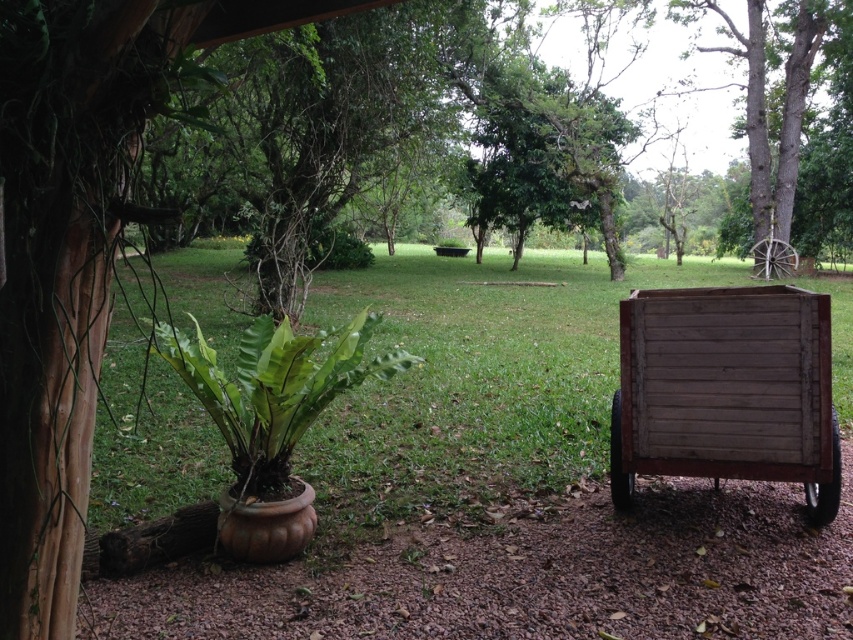
Can you confirm if green grass at center is bigger than weathered wood wagon at lower right?

Yes, green grass at center is bigger than weathered wood wagon at lower right.

Looking at this image, does green grass at center have a smaller size compared to weathered wood wagon at lower right?

Actually, green grass at center might be larger than weathered wood wagon at lower right.

Image resolution: width=853 pixels, height=640 pixels. I want to click on green grass at center, so click(474, 380).

I want to click on green grass at center, so click(474, 380).